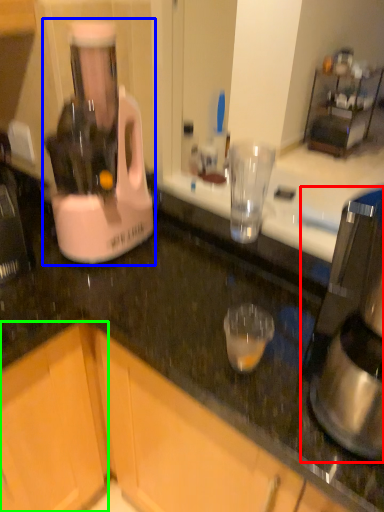
Question: Based on their relative distances, which object is nearer to coffee maker (highlighted by a red box)? Choose from blender (highlighted by a blue box) and cabinetry (highlighted by a green box).

Choices:
 (A) blender
 (B) cabinetry

Answer: (A)